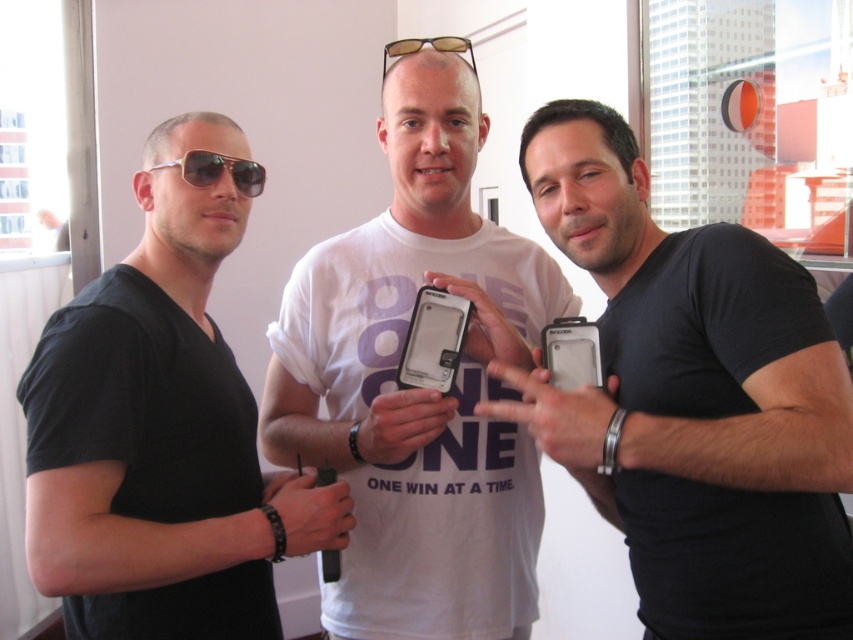
Question: Based on their relative distances, which object is nearer to the clear plastic phone at center?

Choices:
 (A) white matte shirt at center
 (B) black matte phone at center
 (C) black matte t-shirt at left

Answer: (A)

Question: Considering the real-world distances, which object is farthest from the matte black sunglasses at left?

Choices:
 (A) clear plastic phone at center
 (B) matte black phone at center
 (C) black matte phone at center
 (D) black matte t-shirt at left

Answer: (C)

Question: Does white matte shirt at center come in front of matte black phone at center?

Choices:
 (A) yes
 (B) no

Answer: (B)

Question: Does black matte t-shirt at left have a smaller size compared to matte black sunglasses at left?

Choices:
 (A) no
 (B) yes

Answer: (A)

Question: Which object appears farthest from the camera in this image?

Choices:
 (A) black matte t-shirt at left
 (B) black matte phone at center
 (C) white matte shirt at center

Answer: (C)

Question: Is white matte shirt at center below matte black phone at center?

Choices:
 (A) no
 (B) yes

Answer: (A)